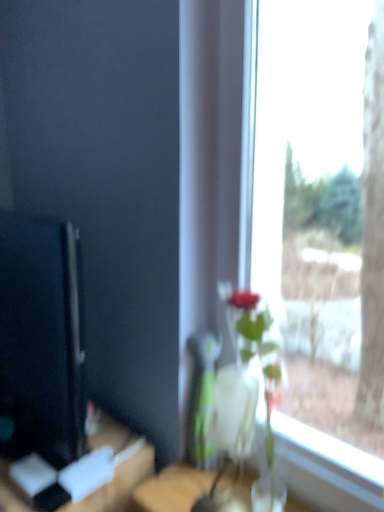
Question: Is point (228, 492) positioned closer to the camera than point (246, 396)?

Choices:
 (A) farther
 (B) closer

Answer: (A)

Question: Based on their sizes in the image, would you say transparent glass vase at center is bigger or smaller than clear glass vase at center?

Choices:
 (A) big
 (B) small

Answer: (A)

Question: Which is farther from the transparent glass vase at center?

Choices:
 (A) clear glass vase at center
 (B) wooden table at lower left
 (C) black glossy computer monitor at left

Answer: (C)

Question: Which is farther from the transparent glass vase at center?

Choices:
 (A) black glossy computer monitor at left
 (B) clear glass vase at center
 (C) wooden table at lower left

Answer: (A)